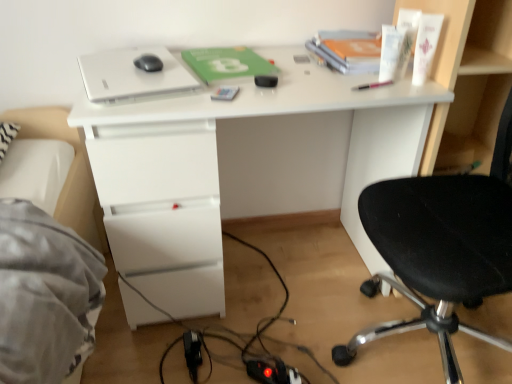
Identify the location of vacant area that lies between metallic silver phone at center, the first stationery from the left, and pink plastic pen at upper right, which is the second stationery from left to right. (295, 89).